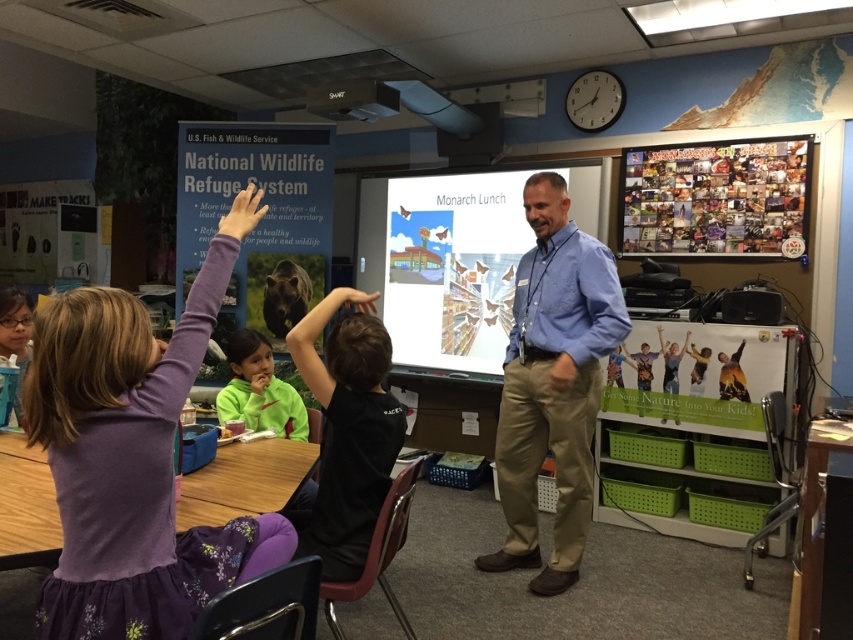
Between multicolored collage at upper right and black plastic projector at upper center, which one appears on the right side from the viewer's perspective?

From the viewer's perspective, multicolored collage at upper right appears more on the right side.

Measure the distance from multicolored collage at upper right to black plastic projector at upper center.

multicolored collage at upper right is 1.91 meters away from black plastic projector at upper center.

Which is in front, point (688, 182) or point (360, 83)?

Positioned in front is point (360, 83).

Identify the location of multicolored collage at upper right. This screenshot has height=640, width=853. (714, 196).

Does purple fabric dress at left appear over blue shirt at center?

Yes, purple fabric dress at left is above blue shirt at center.

Who is higher up, purple fabric dress at left or blue shirt at center?

purple fabric dress at left is higher up.

Does point (146, 548) come behind point (527, 320)?

No, it is not.

Locate an element on the screen. The width and height of the screenshot is (853, 640). purple fabric dress at left is located at coordinates pos(132,460).

Is blue shirt at center taller than multicolored collage at upper right?

Yes.

Is blue shirt at center below multicolored collage at upper right?

Correct, blue shirt at center is located below multicolored collage at upper right.

Which is in front, point (547, 396) or point (648, 193)?

Point (547, 396) is in front.

The image size is (853, 640). Find the location of `blue shirt at center`. blue shirt at center is located at coordinates (553, 384).